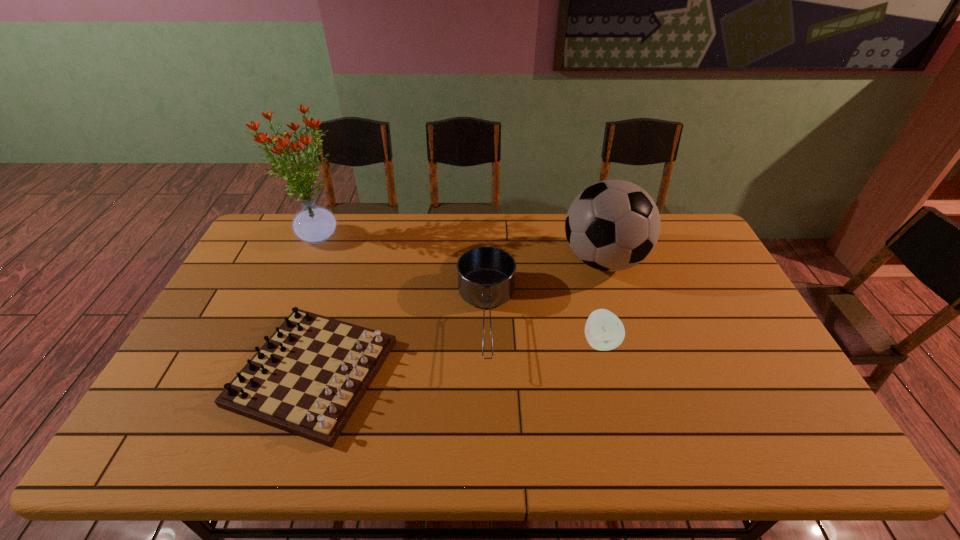
The height and width of the screenshot is (540, 960). I want to click on flower arrangement, so click(313, 224).

You are a GUI agent. You are given a task and a screenshot of the screen. Output one action in this format:
    pyautogui.click(x=<x>, y=<y>)
    Task: Click on the soccer ball
    
    Given the screenshot: What is the action you would take?
    pyautogui.click(x=612, y=225)

Where is `apple`? apple is located at coordinates click(x=604, y=331).

Image resolution: width=960 pixels, height=540 pixels. I want to click on the third object from left to right, so click(486, 275).

This screenshot has width=960, height=540. Find the location of `chessboard`. chessboard is located at coordinates (308, 378).

The width and height of the screenshot is (960, 540). In order to click on free location located on the left of the flower arrangement in this screenshot , I will do `click(260, 235)`.

Find the location of a particular element. The width and height of the screenshot is (960, 540). vacant space located on the front of the fourth shortest object is located at coordinates (618, 309).

Identify the location of free location located 0.170m on the right of the apple. This screenshot has width=960, height=540. (680, 342).

Locate an element on the screen. This screenshot has height=540, width=960. free space located 0.180m with the handle extending from one side of the third object from right to left is located at coordinates (489, 442).

The height and width of the screenshot is (540, 960). Identify the location of free space located 0.130m on the right of the shortest object. (441, 373).